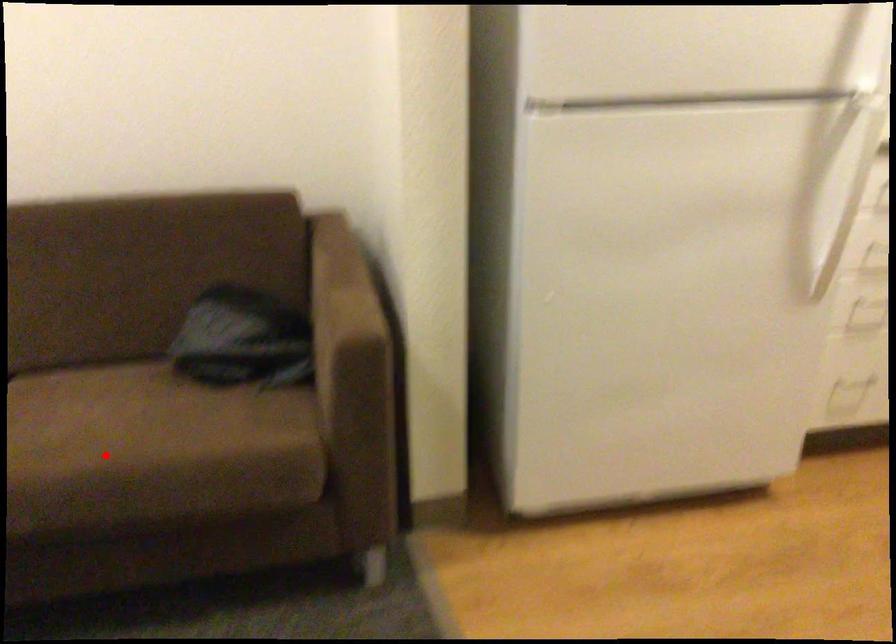
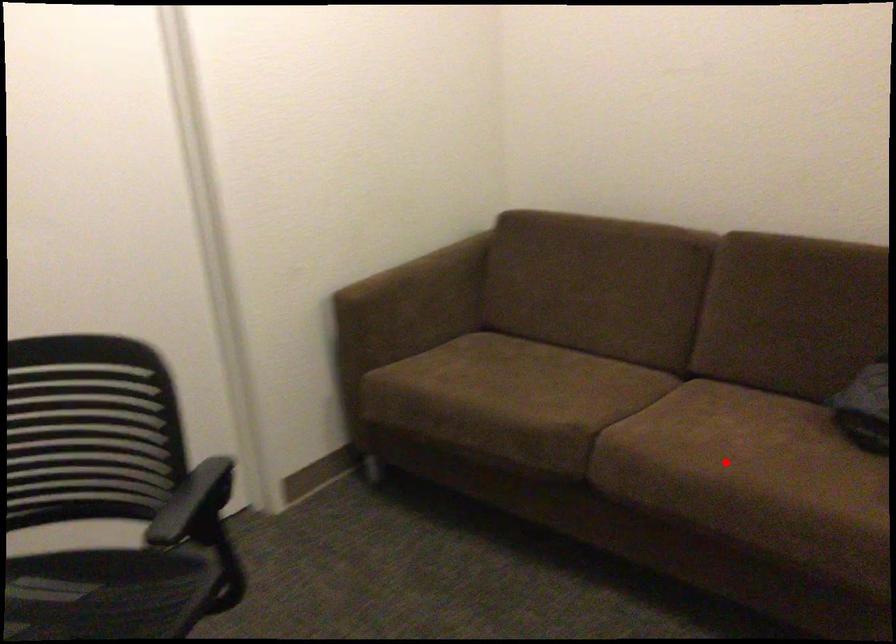
I am providing you with two images of the same scene from different viewpoints. A red point is marked on the first image and another point is marked on the second image. Is the red point in image1 aligned with the point shown in image2?

Yes